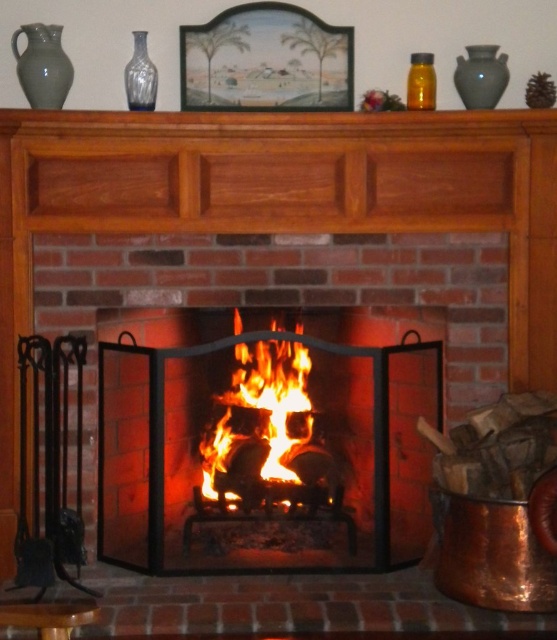
You are standing in front of the fireplace and notice two items in the scene. One is the flaming wood at center and the other is the translucent glass vase at upper center. Which of these two items is positioned to the right of the other?

The flaming wood at center is to the right of the translucent glass vase at upper center.

You are standing in front of the fireplace and want to place a small decoration on the mantelpiece. You have two points marked on the mantelpiece at coordinates point (250, 372) and point (139, 76). Which point is closer to you and suitable for placing the decoration?

Point (139, 76) is closer to you than point (250, 372), so it is more suitable for placing the decoration.

You are an interior designer planning to place a new rectangular shelf between the black metal fireplace at center and the matte gray vase at upper left. The shelf must be wider than both objects. Can you confirm if the shelf will fit if it is 1.2 meters wide?

The black metal fireplace at center is wider than the matte gray vase at upper left. Since the shelf needs to be wider than both, and the fireplace is the wider one, the shelf must be wider than the fireplace. The shelf is 1.2 meters wide, but we need to know the fireplace width to confirm. However, since the description only states the fireplace is wider than the vase, without specific measurements, we can assume the shelf at 1.2 meters may or may not fit depending on the fireplace width. Therefore, more